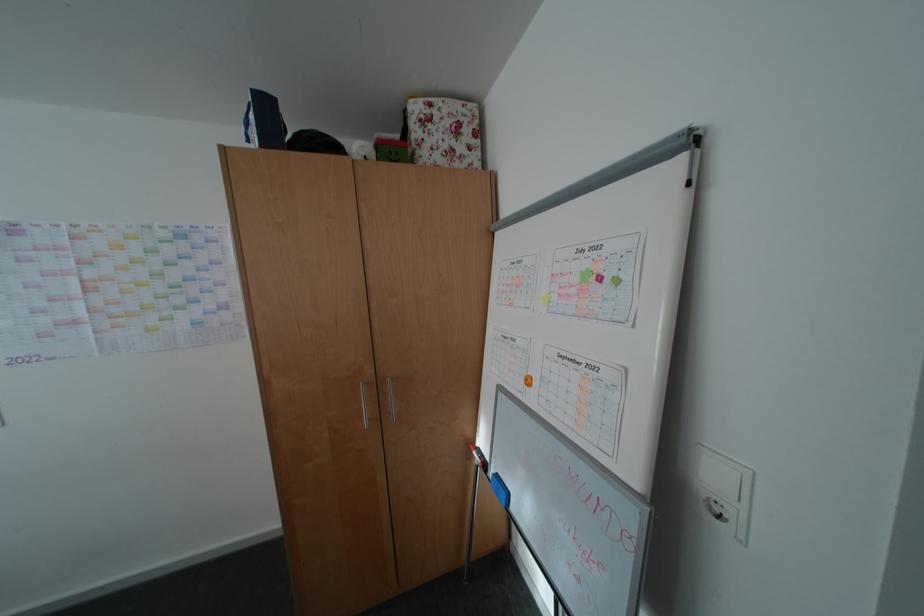
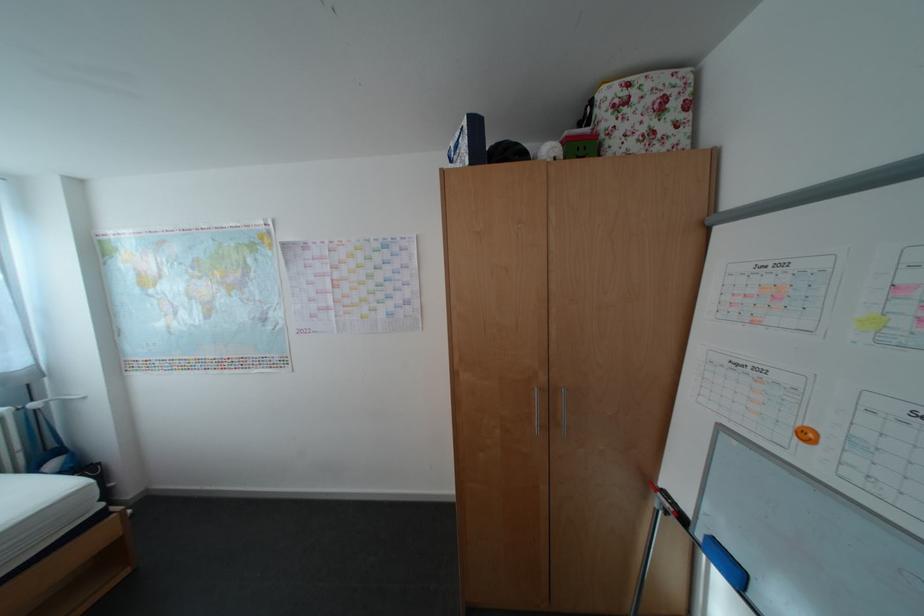
Find the pixel in the second image that matches point (390, 385) in the first image.

(562, 392)